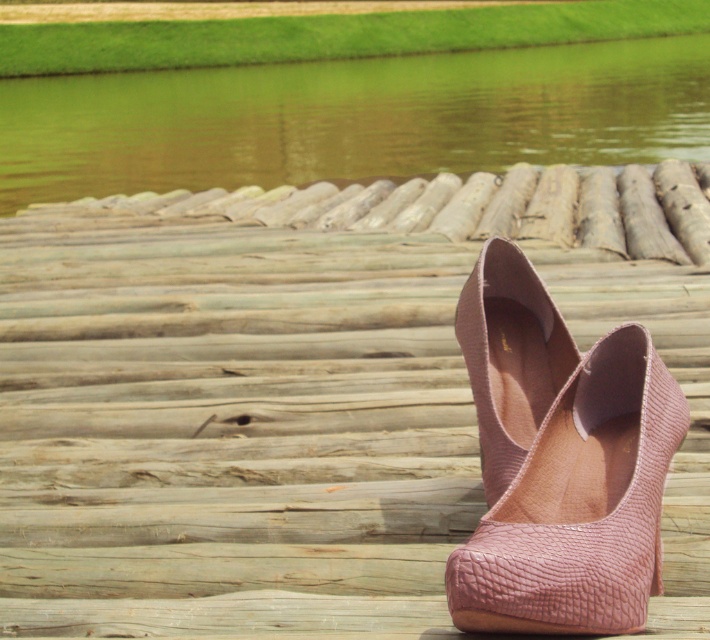
You are standing on the wooden dock and see the green water at upper center and the wooden log at center. Which object is located to the right side of the other?

The wooden log at center is located to the right side of the green water at upper center.